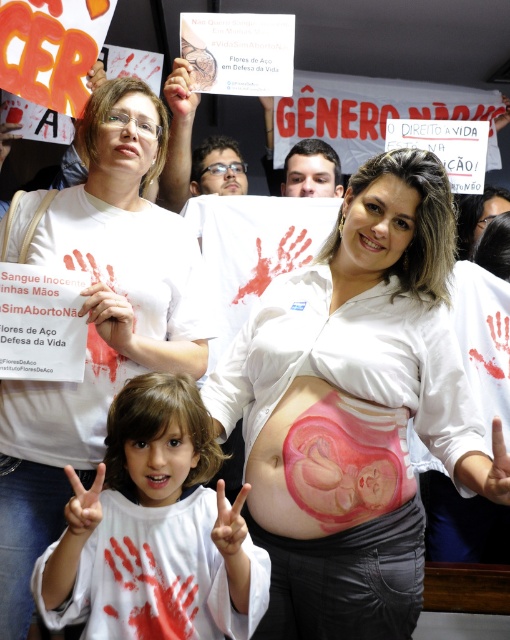
You are a photographer at the protest. You need to position yourself so that both the pink glossy baby at center and the white paper hand at lower left are visible in your shot. Based on their positions, which object should be placed closer to the left side of the frame?

The white paper hand at lower left should be placed closer to the left side of the frame because the pink glossy baby at center is to the right of it.

You are a photographer trying to capture a clear shot of the pink glossy baby at center and the white matte shirt at center. The camera has a depth of field that can focus on objects within 15 inches of each other. Will both objects be in focus?

The pink glossy baby at center is 17.54 inches from the white matte shirt at center. Since the distance exceeds the camera depth of field limit of 15 inches, the two objects cannot both be in focus at the same time.

What object is located at the coordinates point (97, 324)?

The white matte shirt at center is located at point (97, 324).